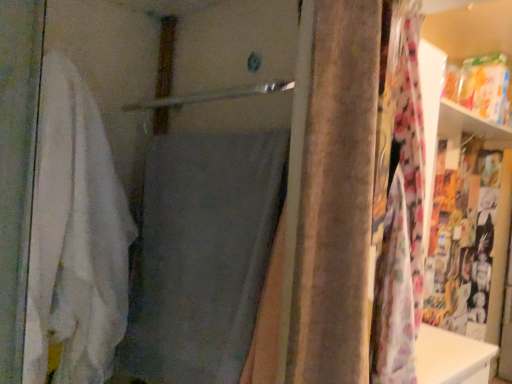
Question: In which direction should I rotate to look at gray fabric bath towel at center, the 2th bath towel positioned from the left?

Choices:
 (A) right
 (B) left

Answer: (B)

Question: Are gray fabric bath towel at center, the 2th bath towel positioned from the left, and white soft towel at left, which appears as the 2th bath towel when viewed from the right, far apart?

Choices:
 (A) no
 (B) yes

Answer: (A)

Question: Does gray fabric bath towel at center, the 2th bath towel positioned from the left, appear on the left side of white soft towel at left, acting as the first bath towel starting from the left?

Choices:
 (A) no
 (B) yes

Answer: (A)

Question: From the image's perspective, is gray fabric bath towel at center, the 2th bath towel positioned from the left, located above white soft towel at left, acting as the first bath towel starting from the left?

Choices:
 (A) yes
 (B) no

Answer: (B)

Question: Is gray fabric bath towel at center, the 2th bath towel positioned from the left, at the right side of white soft towel at left, acting as the first bath towel starting from the left?

Choices:
 (A) yes
 (B) no

Answer: (A)

Question: Does gray fabric bath towel at center, arranged as the first bath towel when viewed from the right, turn towards white soft towel at left, which appears as the 2th bath towel when viewed from the right?

Choices:
 (A) yes
 (B) no

Answer: (A)

Question: Can you confirm if gray fabric bath towel at center, the 2th bath towel positioned from the left, is wider than white soft towel at left, which appears as the 2th bath towel when viewed from the right?

Choices:
 (A) yes
 (B) no

Answer: (B)

Question: From a real-world perspective, is velvet brown curtain at center positioned under white soft towel at left, acting as the first bath towel starting from the left, based on gravity?

Choices:
 (A) yes
 (B) no

Answer: (B)

Question: Does velvet brown curtain at center appear on the left side of white soft towel at left, acting as the first bath towel starting from the left?

Choices:
 (A) yes
 (B) no

Answer: (B)

Question: Can you confirm if velvet brown curtain at center is smaller than white soft towel at left, acting as the first bath towel starting from the left?

Choices:
 (A) yes
 (B) no

Answer: (A)

Question: Can you confirm if velvet brown curtain at center is bigger than white soft towel at left, which appears as the 2th bath towel when viewed from the right?

Choices:
 (A) yes
 (B) no

Answer: (B)

Question: Is velvet brown curtain at center next to white soft towel at left, acting as the first bath towel starting from the left?

Choices:
 (A) no
 (B) yes

Answer: (A)

Question: Can you confirm if velvet brown curtain at center is taller than white soft towel at left, which appears as the 2th bath towel when viewed from the right?

Choices:
 (A) no
 (B) yes

Answer: (A)

Question: Considering the relative sizes of white soft towel at left, acting as the first bath towel starting from the left, and velvet brown curtain at center in the image provided, is white soft towel at left, acting as the first bath towel starting from the left, wider than velvet brown curtain at center?

Choices:
 (A) yes
 (B) no

Answer: (A)